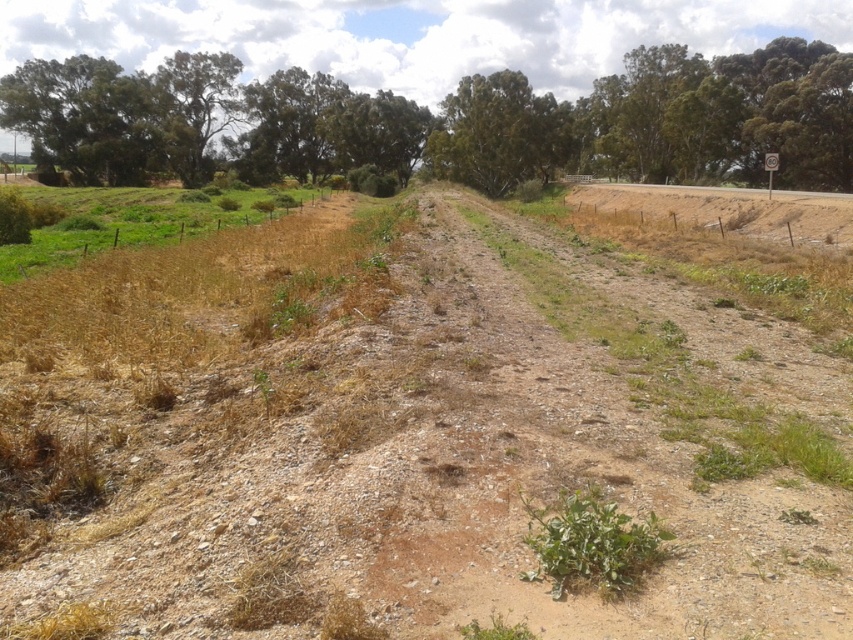
Who is positioned more to the right, dried grass at center or green leafy tree at center?

green leafy tree at center

The image size is (853, 640). What do you see at coordinates (407, 436) in the screenshot?
I see `dried grass at center` at bounding box center [407, 436].

The image size is (853, 640). I want to click on dried grass at center, so click(407, 436).

What do you see at coordinates (120, 224) in the screenshot?
I see `dry grass at left` at bounding box center [120, 224].

Does dry grass at left have a smaller size compared to green leafy plant at center?

Incorrect, dry grass at left is not smaller in size than green leafy plant at center.

Which is behind, point (204, 211) or point (544, 566)?

The point (204, 211) is behind.

Where is `dry grass at left`? The height and width of the screenshot is (640, 853). dry grass at left is located at coordinates (120, 224).

Between green leafy tree at upper center and green leafy plant at center, which one is positioned lower?

green leafy plant at center is below.

Is point (494, 189) positioned after point (602, 516)?

Yes, it is behind point (602, 516).

Where is `green leafy tree at upper center`? green leafy tree at upper center is located at coordinates (463, 122).